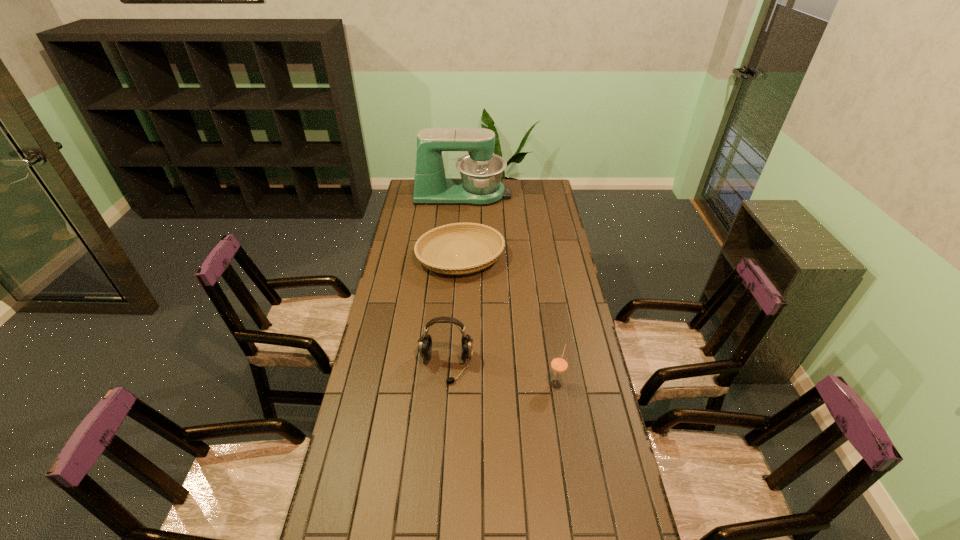
Image resolution: width=960 pixels, height=540 pixels. I want to click on free location located 0.060m on the right of the shortest object, so click(x=518, y=258).

In order to click on object that is at the far edge in this screenshot , I will do `click(481, 171)`.

Identify the location of mixer that is at the left edge. tap(481, 171).

At what (x,y) coordinates should I click in order to perform the action: click on basket located in the left edge section of the desktop. Please return your answer as a coordinate pair (x, y). Looking at the image, I should click on (440, 241).

In order to click on object that is at the right edge in this screenshot , I will do `click(559, 364)`.

You are a GUI agent. You are given a task and a screenshot of the screen. Output one action in this format:
    pyautogui.click(x=<x>, y=<y>)
    Task: Click on the object that is at the far left corner
    This screenshot has width=960, height=540.
    Given the screenshot: What is the action you would take?
    pyautogui.click(x=481, y=171)

The image size is (960, 540). In order to click on free space at the left edge of the desktop in this screenshot , I will do `click(389, 338)`.

In the image, there is a desktop. In order to click on vacant area at the right edge in this screenshot , I will do `click(548, 261)`.

You are a GUI agent. You are given a task and a screenshot of the screen. Output one action in this format:
    pyautogui.click(x=<x>, y=<y>)
    Task: Click on the free point at the far right corner
    Image resolution: width=960 pixels, height=540 pixels.
    Given the screenshot: What is the action you would take?
    pos(532,198)

You are a GUI agent. You are given a task and a screenshot of the screen. Output one action in this format:
    pyautogui.click(x=<x>, y=<y>)
    Task: Click on the free area in between the farthest object and the headset
    The width and height of the screenshot is (960, 540).
    Given the screenshot: What is the action you would take?
    pyautogui.click(x=454, y=280)